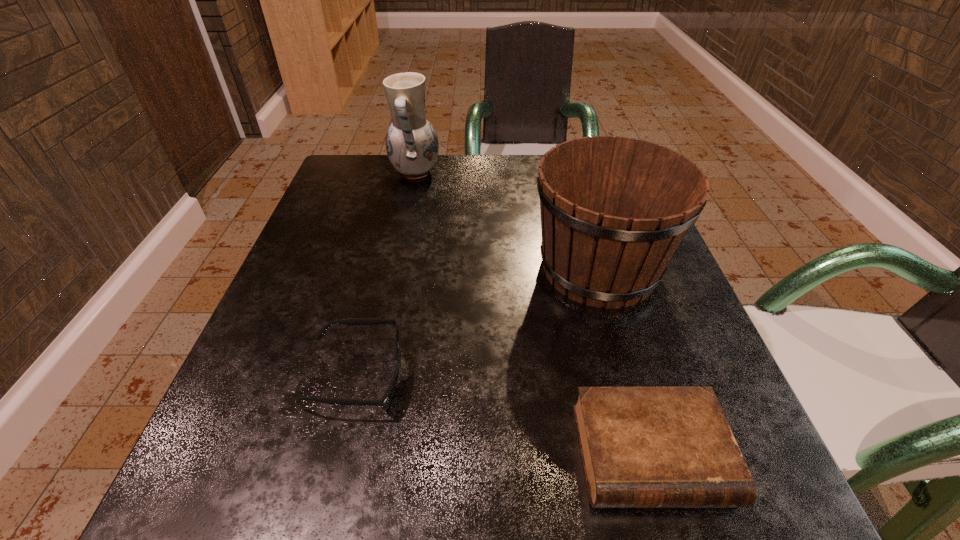
This screenshot has height=540, width=960. In order to click on vacant space in between the diary and the wine bucket in this screenshot , I will do [625, 361].

Identify the location of free spot between the sunglasses and the diary. pyautogui.click(x=504, y=415).

Locate an element on the screen. This screenshot has width=960, height=540. vacant space in between the diary and the second farthest object is located at coordinates (625, 361).

Image resolution: width=960 pixels, height=540 pixels. I want to click on blank region between the pottery and the diary, so click(x=533, y=314).

You are a GUI agent. You are given a task and a screenshot of the screen. Output one action in this format:
    pyautogui.click(x=<x>, y=<y>)
    Task: Click on the free area in between the wine bucket and the sunglasses
    Image resolution: width=960 pixels, height=540 pixels.
    Given the screenshot: What is the action you would take?
    pyautogui.click(x=478, y=322)

Identify the location of free space between the diary and the farthest object. (533, 314).

Locate an element on the screen. free space between the farthest object and the wine bucket is located at coordinates (507, 221).

At what (x,y) coordinates should I click in order to perform the action: click on free space between the farthest object and the third nearest object. Please return your answer as a coordinate pair (x, y). The image size is (960, 540). Looking at the image, I should click on (507, 221).

This screenshot has height=540, width=960. Identify the location of vacant space that is in between the diary and the farthest object. (533, 314).

You are a GUI agent. You are given a task and a screenshot of the screen. Output one action in this format:
    pyautogui.click(x=<x>, y=<y>)
    Task: Click on the free space between the pottery and the wine bucket
    The width and height of the screenshot is (960, 540).
    Given the screenshot: What is the action you would take?
    pyautogui.click(x=507, y=221)